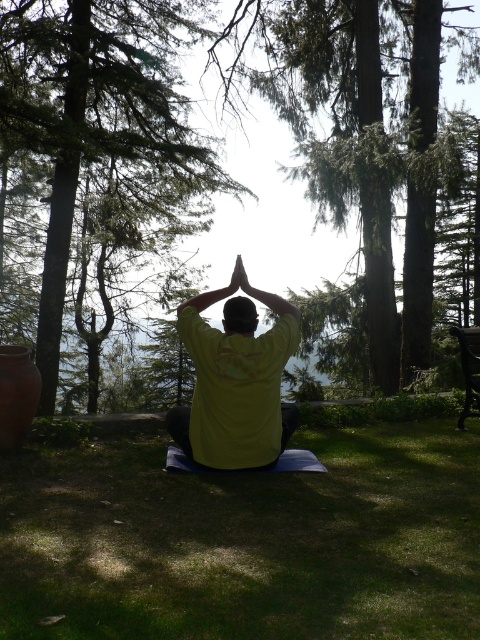
Does green grass at center have a smaller size compared to dark brown wooden bench at right?

No, green grass at center is not smaller than dark brown wooden bench at right.

This screenshot has height=640, width=480. In order to click on green grass at center in this screenshot , I will do `click(245, 541)`.

Describe the element at coordinates (245, 541) in the screenshot. I see `green grass at center` at that location.

Where is `green grass at center`? The height and width of the screenshot is (640, 480). green grass at center is located at coordinates (245, 541).

Does green leafy tree at center have a lesser width compared to yellow matte shirt at center?

Correct, green leafy tree at center's width is less than yellow matte shirt at center's.

Who is positioned more to the left, green leafy tree at center or yellow matte shirt at center?

Positioned to the left is green leafy tree at center.

This screenshot has height=640, width=480. I want to click on green leafy tree at center, so click(101, 124).

Locate an element on the screen. The image size is (480, 640). green leafy tree at center is located at coordinates (101, 124).

Which is more to the right, green grass at center or yellow matte shirt at center?

green grass at center is more to the right.

Does green grass at center have a smaller size compared to yellow matte shirt at center?

Yes.

Locate an element on the screen. This screenshot has height=640, width=480. green grass at center is located at coordinates (245, 541).